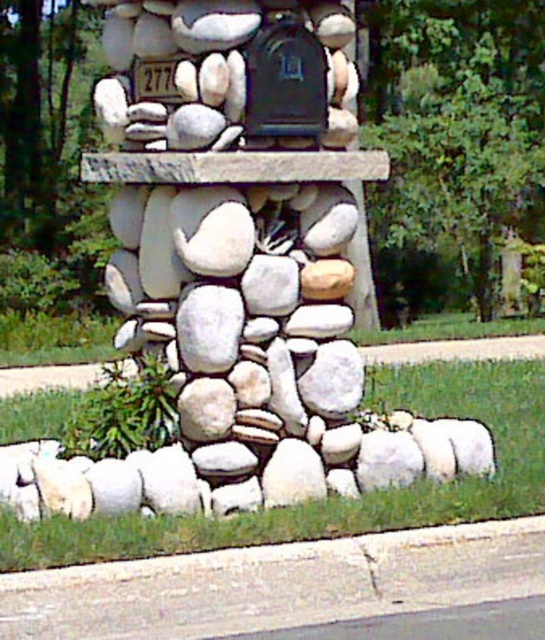
Question: Is the position of white stone sculpture at center more distant than that of gray concrete curb at lower left?

Choices:
 (A) no
 (B) yes

Answer: (B)

Question: Which point is farther to the camera?

Choices:
 (A) (142, 596)
 (B) (209, 339)

Answer: (B)

Question: Is white stone sculpture at center thinner than gray concrete curb at lower left?

Choices:
 (A) no
 (B) yes

Answer: (A)

Question: Where is gray concrete curb at lower left located in relation to black matte mailbox at center in the image?

Choices:
 (A) below
 (B) above

Answer: (A)

Question: Which of the following is the farthest from the observer?

Choices:
 (A) black matte mailbox at center
 (B) white stone sculpture at center
 (C) gray concrete curb at lower left

Answer: (A)

Question: Estimate the real-world distances between objects in this image. Which object is farther from the white stone sculpture at center?

Choices:
 (A) gray concrete curb at lower left
 (B) black matte mailbox at center

Answer: (A)